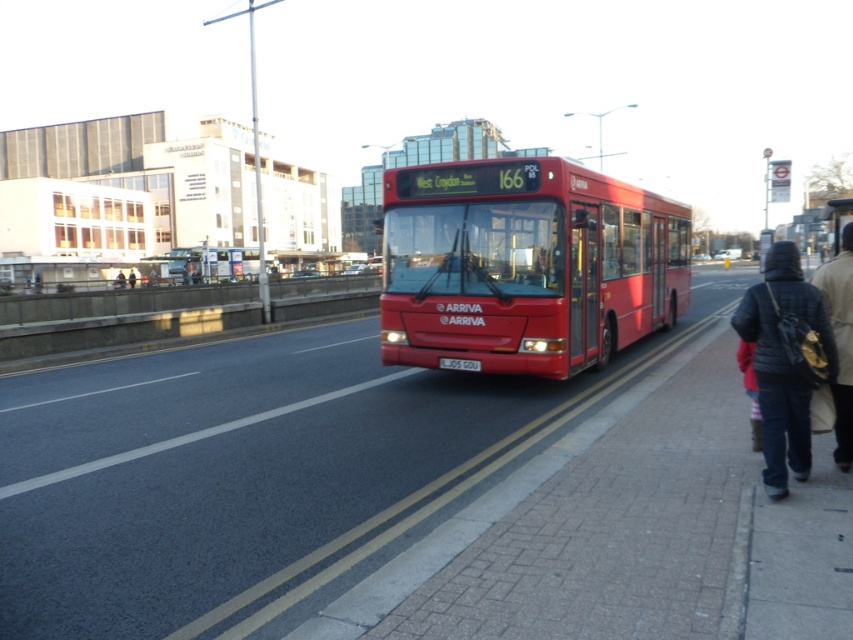
You are a pedestrian waiting at the bus stop and see a denim jacket at lower right and a dark blue jacket at center. Which jacket is shorter in height?

The denim jacket at lower right is shorter in height compared to the dark blue jacket at center.

You are a pedestrian standing at the bus stop and see both the dark blue denim jacket at lower right and the dark blue jacket at center. Which jacket is positioned closer to the right side of the road?

The dark blue denim jacket at lower right is positioned closer to the right side of the road since it is to the right of the dark blue jacket at center.

Looking at this image, you are a pedestrian standing at the bus stop. You see the matte red bus at center and the dark blue denim jacket at lower right. Which object is taller?

The matte red bus at center is taller than the dark blue denim jacket at lower right.